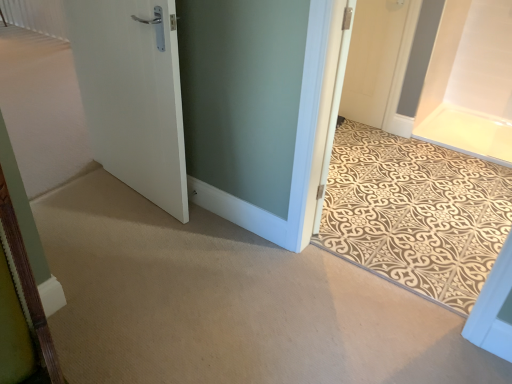
Question: Considering the relative sizes of white matte door at left, which ranks as the second door in left-to-right order, and white matte door at left, arranged as the 1th door when viewed from the left, in the image provided, is white matte door at left, which ranks as the second door in left-to-right order, taller than white matte door at left, arranged as the 1th door when viewed from the left,?

Choices:
 (A) no
 (B) yes

Answer: (B)

Question: From the image's perspective, is white matte door at left, marked as the 1th door in a front-to-back arrangement, on top of white matte door at left, arranged as the 1th door when viewed from the left?

Choices:
 (A) no
 (B) yes

Answer: (A)

Question: Can we say white matte door at left, acting as the 3th door starting from the back, lies outside white matte door at left, marked as the 2th door in a front-to-back arrangement?

Choices:
 (A) yes
 (B) no

Answer: (A)

Question: Does white matte door at left, which ranks as the second door in left-to-right order, have a larger size compared to white matte door at left, arranged as the 1th door when viewed from the left?

Choices:
 (A) yes
 (B) no

Answer: (B)

Question: Is white matte door at left, marked as the 1th door in a front-to-back arrangement, smaller than white matte door at left, the 2th door from the back?

Choices:
 (A) no
 (B) yes

Answer: (B)

Question: From the image's perspective, is white matte door at left, which ranks as the second door in left-to-right order, under white matte door at left, marked as the 2th door in a front-to-back arrangement?

Choices:
 (A) yes
 (B) no

Answer: (A)

Question: From the image's perspective, is white matte door at left, acting as the 3th door starting from the back, located above beige patterned mat at center?

Choices:
 (A) yes
 (B) no

Answer: (A)

Question: Can you confirm if white matte door at left, acting as the 3th door starting from the back, is bigger than beige patterned mat at center?

Choices:
 (A) no
 (B) yes

Answer: (A)

Question: Is white matte door at left, positioned as the second door in right-to-left order, wider than beige patterned mat at center?

Choices:
 (A) yes
 (B) no

Answer: (B)

Question: From the image's perspective, is white matte door at left, marked as the 1th door in a front-to-back arrangement, beneath beige patterned mat at center?

Choices:
 (A) no
 (B) yes

Answer: (A)

Question: From a real-world perspective, is white matte door at left, marked as the 1th door in a front-to-back arrangement, beneath beige patterned mat at center?

Choices:
 (A) no
 (B) yes

Answer: (B)

Question: Does white matte door at left, marked as the 1th door in a front-to-back arrangement, appear on the right side of beige patterned mat at center?

Choices:
 (A) no
 (B) yes

Answer: (A)

Question: Is white matte door at upper right, acting as the 1th door starting from the back, closer to camera compared to white matte door at left, the 2th door from the back?

Choices:
 (A) yes
 (B) no

Answer: (B)